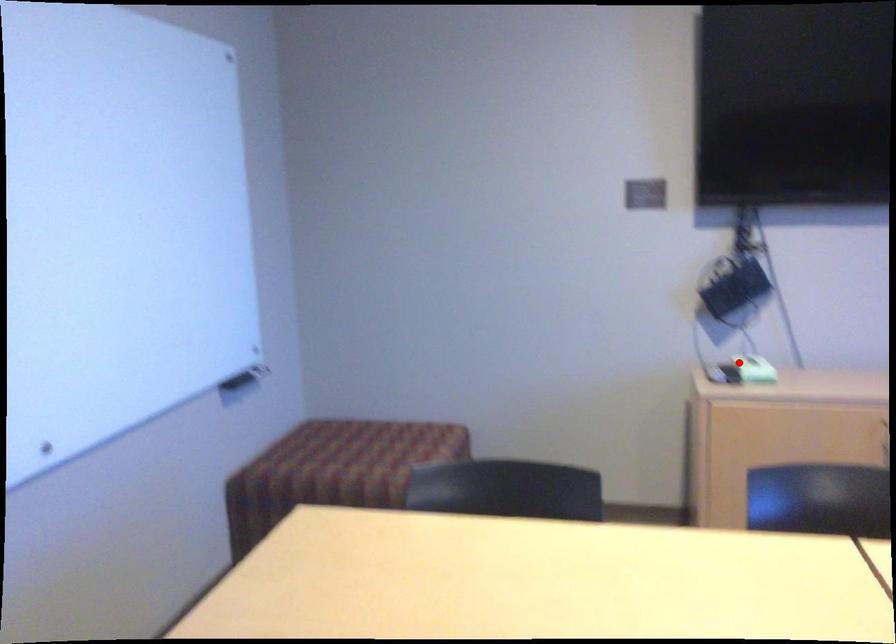
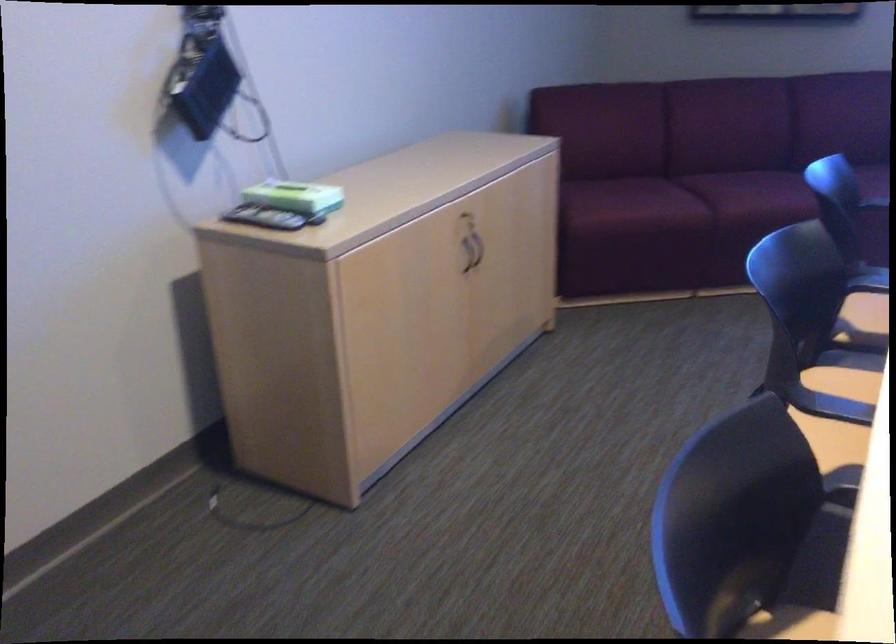
Question: I am providing you with two images of the same scene from different viewpoints. A red point is marked on the first image. Is the red point's position out of view in image 2?

Choices:
 (A) Yes
 (B) No

Answer: (B)